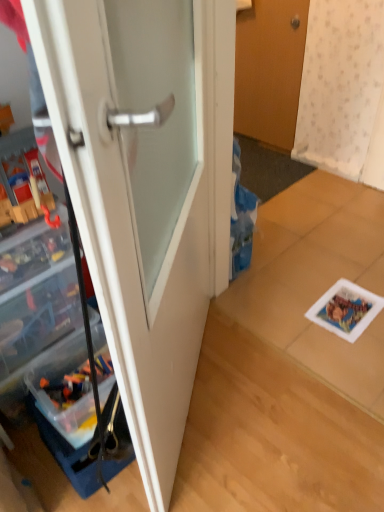
Question: From the image's perspective, is wooden door at upper center, which is counted as the 1th door, starting from the right, beneath white glossy door at center, placed as the 2th door when sorted from back to front?

Choices:
 (A) yes
 (B) no

Answer: (B)

Question: From a real-world perspective, is wooden door at upper center, which is the second door in bottom-to-top order, on top of white glossy door at center, placed as the 2th door when sorted from back to front?

Choices:
 (A) no
 (B) yes

Answer: (A)

Question: From a real-world perspective, is wooden door at upper center, marked as the 2th door in a left-to-right arrangement, beneath white glossy door at center, the 1th door when ordered from bottom to top?

Choices:
 (A) no
 (B) yes

Answer: (B)

Question: Could you tell me if wooden door at upper center, which is the second door in bottom-to-top order, is turned towards white glossy door at center, the 2th door from the top?

Choices:
 (A) no
 (B) yes

Answer: (A)

Question: Does wooden door at upper center, which is the second door in bottom-to-top order, touch white glossy door at center, the 2th door from the top?

Choices:
 (A) no
 (B) yes

Answer: (A)

Question: Considering the relative sizes of wooden door at upper center, which is the second door in bottom-to-top order, and white glossy door at center, the 1th door when ordered from bottom to top, in the image provided, is wooden door at upper center, which is the second door in bottom-to-top order, bigger than white glossy door at center, the 1th door when ordered from bottom to top,?

Choices:
 (A) no
 (B) yes

Answer: (A)

Question: Is white glossy door at center, marked as the second door in a right-to-left arrangement, at the right side of wooden door at upper center, which is the second door from front to back?

Choices:
 (A) yes
 (B) no

Answer: (B)

Question: Is white glossy door at center, the first door when ordered from left to right, located outside wooden door at upper center, which is the second door in bottom-to-top order?

Choices:
 (A) yes
 (B) no

Answer: (A)

Question: Does white glossy door at center, the 2th door from the top, turn towards wooden door at upper center, which is the second door in bottom-to-top order?

Choices:
 (A) no
 (B) yes

Answer: (A)

Question: Is white glossy door at center, marked as the second door in a right-to-left arrangement, not close to wooden door at upper center, which is the second door in bottom-to-top order?

Choices:
 (A) yes
 (B) no

Answer: (A)

Question: From the image's perspective, is white glossy door at center, the 1th door when ordered from bottom to top, on wooden door at upper center, which is the second door in bottom-to-top order?

Choices:
 (A) no
 (B) yes

Answer: (A)

Question: Is wooden door at upper center, which is the second door in bottom-to-top order, completely or partially inside white glossy door at center, the 2th door from the top?

Choices:
 (A) yes
 (B) no

Answer: (B)

Question: Is white glossy door at center, placed as the 2th door when sorted from back to front, directly adjacent to clear plastic cabinet at left?

Choices:
 (A) yes
 (B) no

Answer: (B)